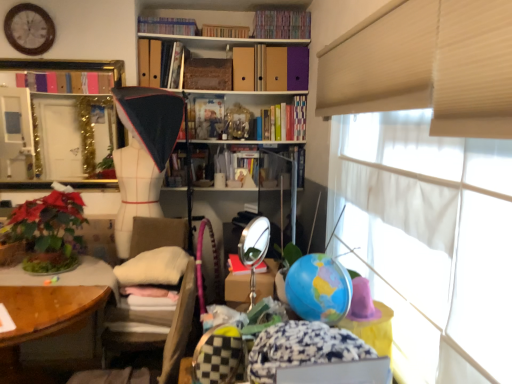
Question: Is matte plastic book at center, which appears as the second book when ordered from the bottom, bigger than gold metallic mirror at upper left?

Choices:
 (A) yes
 (B) no

Answer: (B)

Question: Is matte plastic book at center, which appears as the 5th book when viewed from the top, positioned before gold metallic mirror at upper left?

Choices:
 (A) no
 (B) yes

Answer: (A)

Question: Would you say matte plastic book at center, which appears as the 5th book when viewed from the top, is outside gold metallic mirror at upper left?

Choices:
 (A) no
 (B) yes

Answer: (B)

Question: Considering the relative sizes of matte plastic book at center, which appears as the 5th book when viewed from the top, and gold metallic mirror at upper left in the image provided, is matte plastic book at center, which appears as the 5th book when viewed from the top, shorter than gold metallic mirror at upper left?

Choices:
 (A) no
 (B) yes

Answer: (B)

Question: Are matte plastic book at center, which appears as the 5th book when viewed from the top, and gold metallic mirror at upper left located far from each other?

Choices:
 (A) no
 (B) yes

Answer: (A)

Question: From their relative heights in the image, would you say white fabric mannequin at center is taller or shorter than wooden clock at upper left?

Choices:
 (A) short
 (B) tall

Answer: (B)

Question: From a real-world perspective, is white fabric mannequin at center positioned above or below wooden clock at upper left?

Choices:
 (A) above
 (B) below

Answer: (B)

Question: Relative to wooden clock at upper left, is white fabric mannequin at center in front or behind?

Choices:
 (A) front
 (B) behind

Answer: (A)

Question: Based on their positions, is white fabric mannequin at center located to the left or right of wooden clock at upper left?

Choices:
 (A) right
 (B) left

Answer: (A)

Question: Based on their positions, is matte cardboard book at upper center, positioned as the 3th book in bottom-to-top order, located to the left or right of hardcover books at upper center, which is the 6th book in top-to-bottom order?

Choices:
 (A) left
 (B) right

Answer: (A)

Question: Is matte cardboard book at upper center, positioned as the 3th book in bottom-to-top order, taller or shorter than hardcover books at upper center, which is the 6th book in top-to-bottom order?

Choices:
 (A) tall
 (B) short

Answer: (B)

Question: In the image, is matte cardboard book at upper center, positioned as the 3th book in bottom-to-top order, positioned in front of or behind hardcover books at upper center, marked as the 1th book in a bottom-to-top arrangement?

Choices:
 (A) front
 (B) behind

Answer: (A)

Question: Considering the positions of matte cardboard book at upper center, positioned as the fourth book in top-to-bottom order, and hardcover books at upper center, marked as the 1th book in a bottom-to-top arrangement, in the image, is matte cardboard book at upper center, positioned as the fourth book in top-to-bottom order, wider or thinner than hardcover books at upper center, marked as the 1th book in a bottom-to-top arrangement,?

Choices:
 (A) thin
 (B) wide

Answer: (A)

Question: From the image's perspective, is green leafy plant at lower left located above or below white fabric mannequin at center?

Choices:
 (A) below
 (B) above

Answer: (A)

Question: Is point (48, 223) positioned closer to the camera than point (124, 87)?

Choices:
 (A) closer
 (B) farther

Answer: (A)